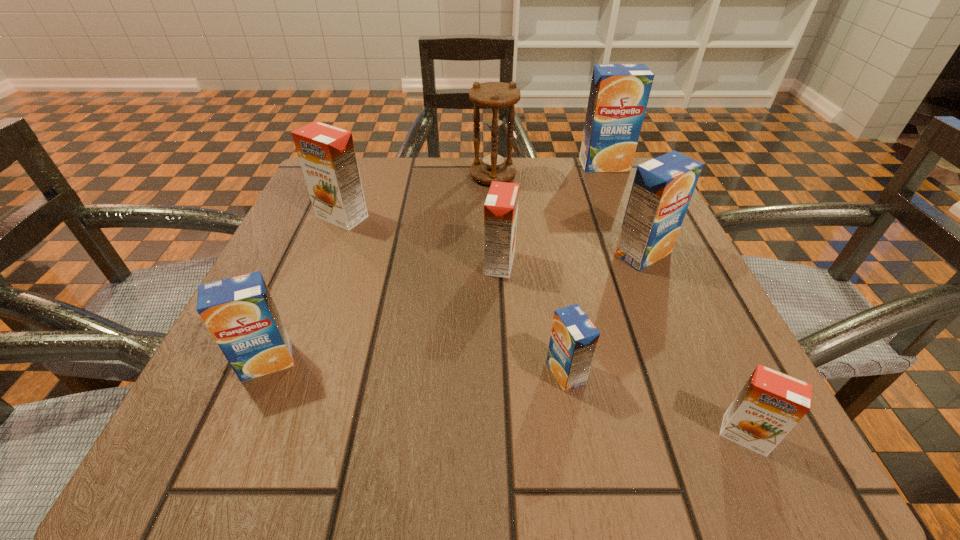
At what (x,y) coordinates should I click in order to perform the action: click on the tallest orange juice. Please return your answer as a coordinate pair (x, y). The image size is (960, 540). Looking at the image, I should click on (619, 93).

The height and width of the screenshot is (540, 960). Find the location of `the biggest blue orange_juice`. the biggest blue orange_juice is located at coordinates (619, 93).

Find the location of a particular element. hourglass is located at coordinates (494, 164).

Identify the location of the second biggest blue orange_juice. (662, 189).

Where is `the leftmost orange orange juice`? This screenshot has height=540, width=960. the leftmost orange orange juice is located at coordinates (327, 155).

Locate an element on the screen. The image size is (960, 540). the sixth nearest orange juice is located at coordinates (327, 155).

This screenshot has height=540, width=960. I want to click on the second farthest orange orange juice, so click(x=501, y=206).

At what (x,y) coordinates should I click in order to perform the action: click on the second orange orange juice from right to left. Please return your answer as a coordinate pair (x, y). This screenshot has width=960, height=540. Looking at the image, I should click on (501, 206).

Where is `the second smallest blue orange_juice`? The image size is (960, 540). the second smallest blue orange_juice is located at coordinates (239, 312).

Locate an element on the screen. The image size is (960, 540). the fourth object from right to left is located at coordinates (574, 338).